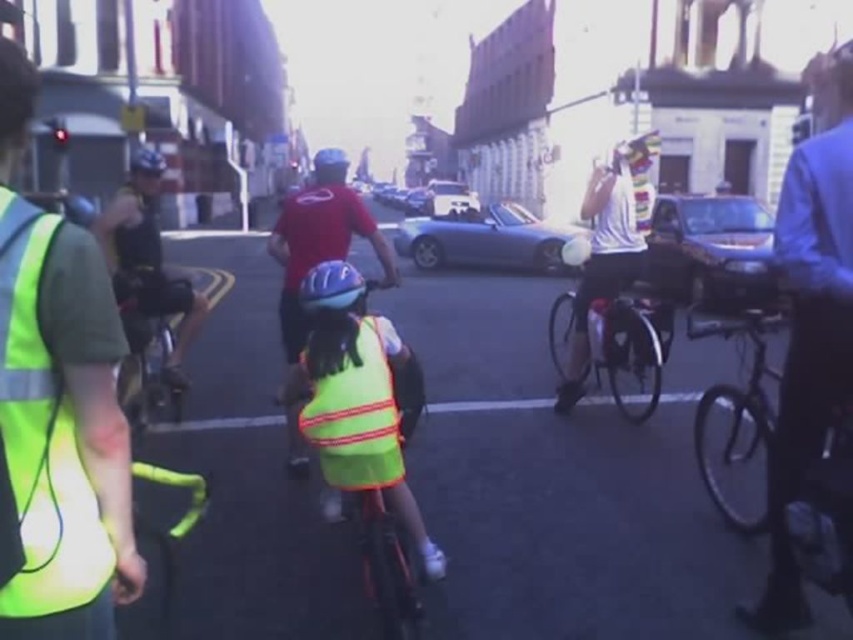
Can you confirm if neon yellow reflective vest at left is positioned above neon yellow reflective safety vest at center?

Yes.

Can you confirm if neon yellow reflective vest at left is shorter than neon yellow reflective safety vest at center?

No.

Measure the distance between neon yellow reflective vest at left and camera.

neon yellow reflective vest at left is 36.34 inches from camera.

Locate an element on the screen. neon yellow reflective vest at left is located at coordinates (64, 436).

Is neon yellow reflective vest at left positioned behind blue matte helmet at center?

No.

Which is more to the left, neon yellow reflective vest at left or blue matte helmet at center?

From the viewer's perspective, neon yellow reflective vest at left appears more on the left side.

Who is more distant from viewer, (15, 305) or (318, 278)?

Positioned behind is point (318, 278).

Locate an element on the screen. The image size is (853, 640). neon yellow reflective vest at left is located at coordinates tap(64, 436).

Consider the image. Is matte red shirt at center below shiny metallic bicycle at left?

No, matte red shirt at center is not below shiny metallic bicycle at left.

Can you confirm if matte red shirt at center is smaller than shiny metallic bicycle at left?

Actually, matte red shirt at center might be larger than shiny metallic bicycle at left.

Between point (364, 214) and point (146, 337), which one is positioned behind?

The point (146, 337) is behind.

What are the coordinates of `matte red shirt at center` in the screenshot? It's located at (318, 240).